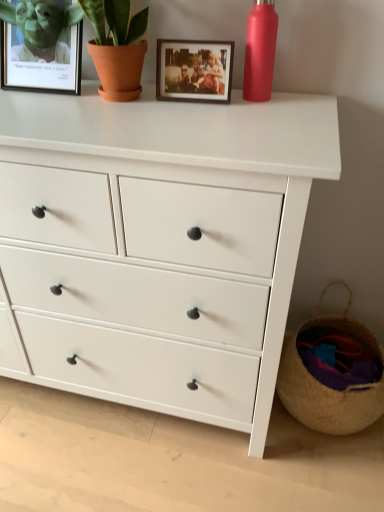
Question: Considering the positions of woven straw basket at lower right and matte black picture frame at upper left, the 2th picture frame viewed from the right, in the image, is woven straw basket at lower right taller or shorter than matte black picture frame at upper left, the 2th picture frame viewed from the right,?

Choices:
 (A) short
 (B) tall

Answer: (B)

Question: From the image's perspective, is woven straw basket at lower right located above or below matte black picture frame at upper left, marked as the 1th picture frame in a left-to-right arrangement?

Choices:
 (A) below
 (B) above

Answer: (A)

Question: Which of these objects is positioned closest to the woven straw basket at lower right?

Choices:
 (A) wooden photo frame at upper center, which is counted as the 2th picture frame, starting from the left
 (B) matte black picture frame at upper left, the 2th picture frame viewed from the right
 (C) matte red bottle at upper right
 (D) white matte chest of drawers at center

Answer: (D)

Question: Considering the real-world distances, which object is farthest from the wooden photo frame at upper center, which is counted as the 2th picture frame, starting from the left?

Choices:
 (A) woven straw basket at lower right
 (B) matte black picture frame at upper left, marked as the 1th picture frame in a left-to-right arrangement
 (C) white matte chest of drawers at center
 (D) matte red bottle at upper right

Answer: (A)